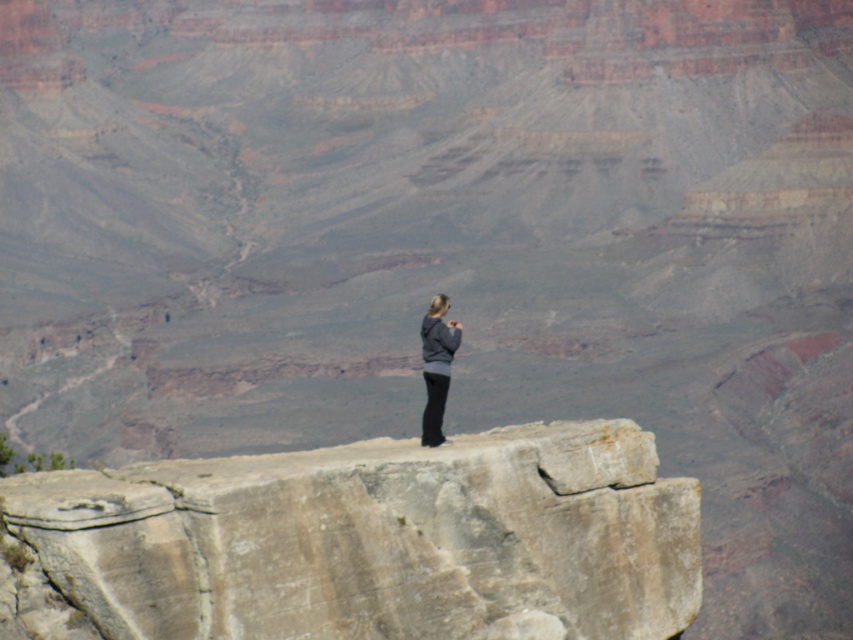
Question: Which point is farther to the camera?

Choices:
 (A) (358, 522)
 (B) (457, 330)

Answer: (B)

Question: Which point is closer to the camera?

Choices:
 (A) rustic stone cliff at center
 (B) gray fabric jacket at center

Answer: (A)

Question: Does rustic stone cliff at center come in front of gray fabric jacket at center?

Choices:
 (A) yes
 (B) no

Answer: (A)

Question: Is rustic stone cliff at center positioned before gray fabric jacket at center?

Choices:
 (A) yes
 (B) no

Answer: (A)

Question: Is rustic stone cliff at center positioned at the back of gray fabric jacket at center?

Choices:
 (A) yes
 (B) no

Answer: (B)